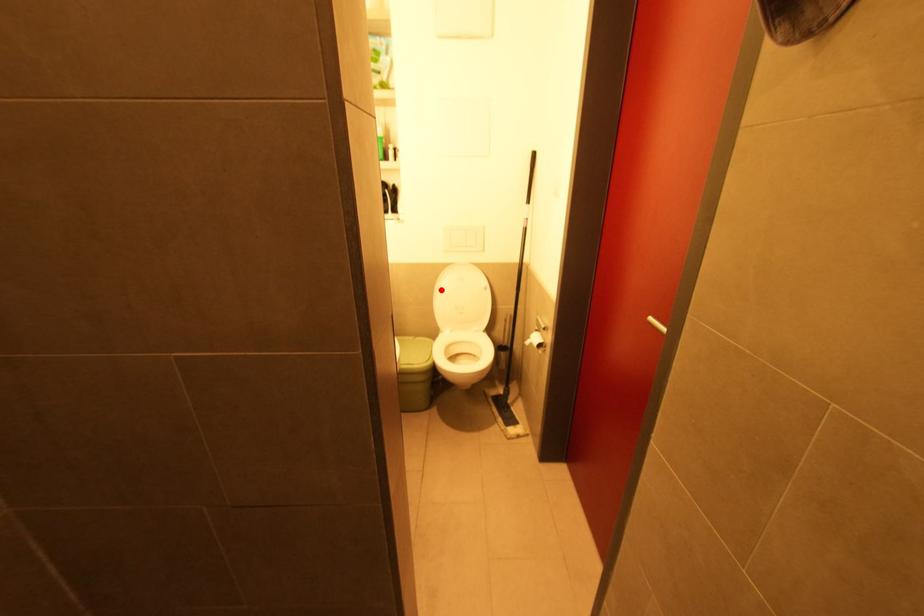
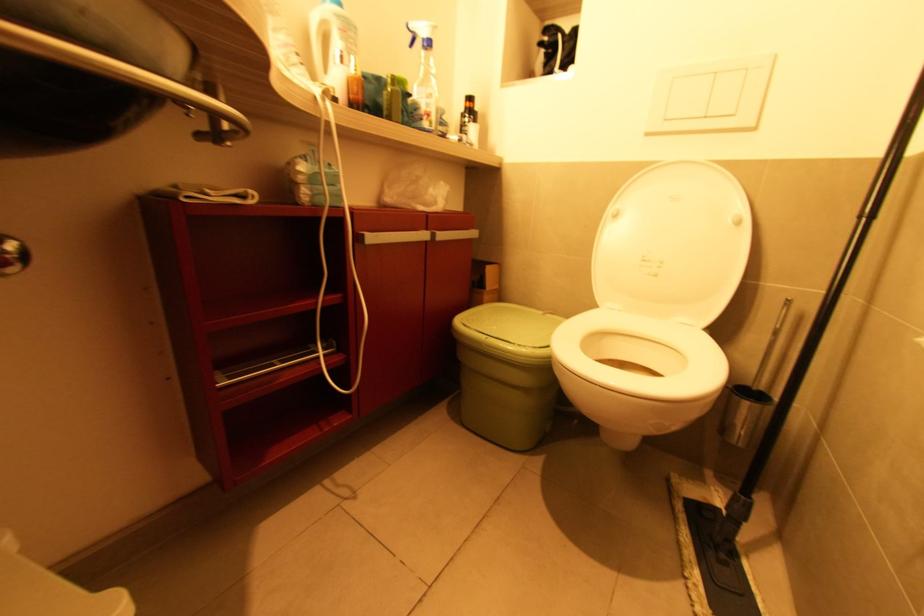
Question: I am providing you with two images of the same scene from different viewpoints. A red point is marked on the first image. Is the red point's position out of view in image 2?

Choices:
 (A) Yes
 (B) No

Answer: (B)